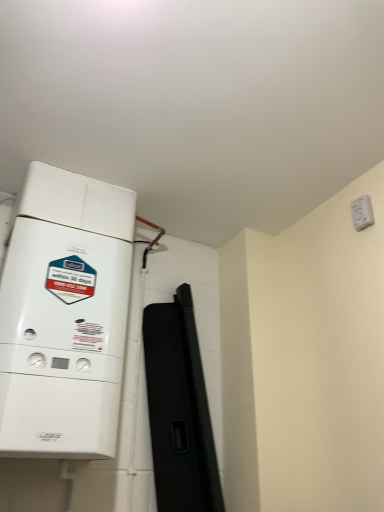
Question: Considering the relative sizes of white matte boiler at left and white plastic switch at upper right in the image provided, is white matte boiler at left bigger than white plastic switch at upper right?

Choices:
 (A) yes
 (B) no

Answer: (A)

Question: Would you consider white matte boiler at left to be distant from white plastic switch at upper right?

Choices:
 (A) yes
 (B) no

Answer: (A)

Question: Is white matte boiler at left at the left side of white plastic switch at upper right?

Choices:
 (A) yes
 (B) no

Answer: (A)

Question: From a real-world perspective, is white matte boiler at left on white plastic switch at upper right?

Choices:
 (A) no
 (B) yes

Answer: (A)

Question: Is white matte boiler at left positioned with its back to white plastic switch at upper right?

Choices:
 (A) yes
 (B) no

Answer: (B)

Question: Does white matte boiler at left have a greater width compared to white plastic switch at upper right?

Choices:
 (A) yes
 (B) no

Answer: (A)

Question: Is white plastic switch at upper right not near white matte boiler at left?

Choices:
 (A) no
 (B) yes

Answer: (B)

Question: Is white plastic switch at upper right behind white matte boiler at left?

Choices:
 (A) yes
 (B) no

Answer: (A)

Question: Could white matte boiler at left be considered to be inside white plastic switch at upper right?

Choices:
 (A) yes
 (B) no

Answer: (B)

Question: Does white plastic switch at upper right have a lesser height compared to white matte boiler at left?

Choices:
 (A) no
 (B) yes

Answer: (B)

Question: From the image's perspective, is white plastic switch at upper right beneath white matte boiler at left?

Choices:
 (A) no
 (B) yes

Answer: (A)

Question: Can you confirm if white plastic switch at upper right is wider than white matte boiler at left?

Choices:
 (A) no
 (B) yes

Answer: (A)

Question: From a real-world perspective, relative to white plastic switch at upper right, is white matte boiler at left vertically above or below?

Choices:
 (A) above
 (B) below

Answer: (B)